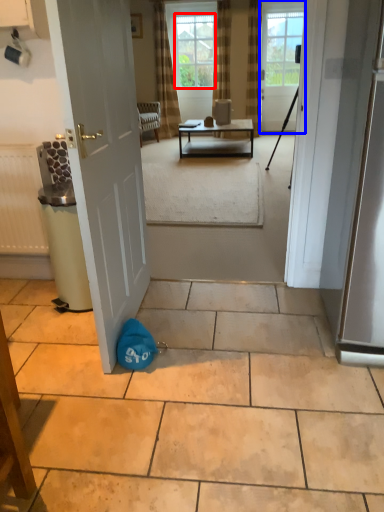
Question: Which object appears farthest to the camera in this image, window screen (highlighted by a red box) or door (highlighted by a blue box)?

Choices:
 (A) window screen
 (B) door

Answer: (A)